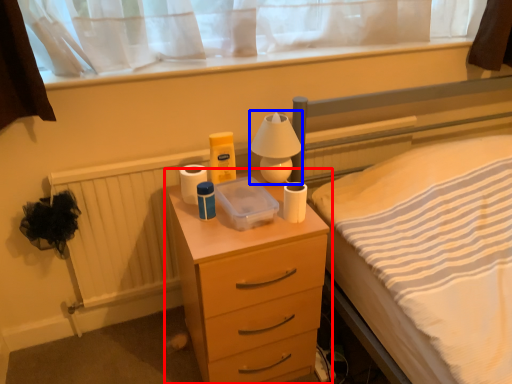
Question: Which object appears closest to the camera in this image, chest of drawers (highlighted by a red box) or bedside lamp (highlighted by a blue box)?

Choices:
 (A) chest of drawers
 (B) bedside lamp

Answer: (A)